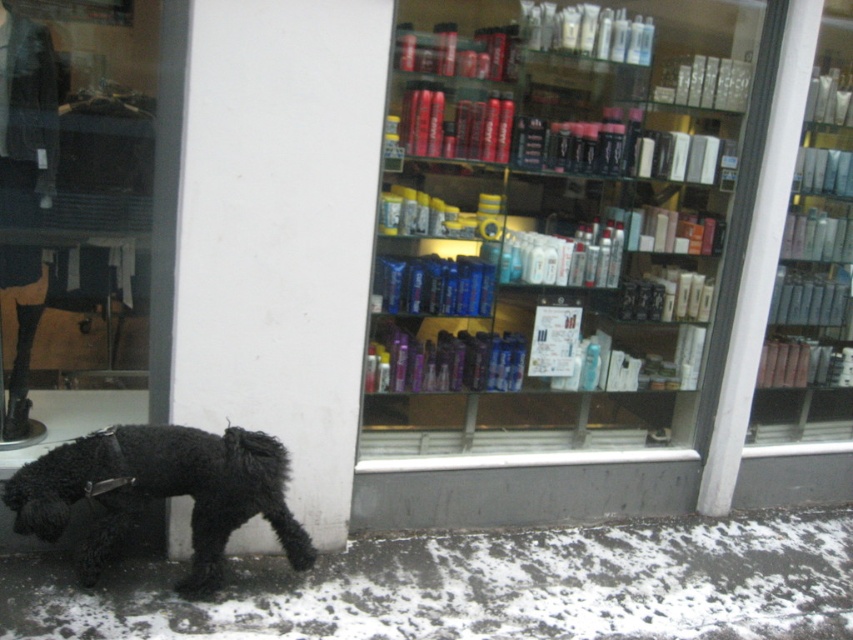
Question: Does translucent glass shelves at center have a greater width compared to black fuzzy dog at lower left?

Choices:
 (A) yes
 (B) no

Answer: (A)

Question: Which point appears closest to the camera in this image?

Choices:
 (A) (245, 444)
 (B) (583, 372)

Answer: (A)

Question: Among these points, which one is farthest from the camera?

Choices:
 (A) (88, 570)
 (B) (477, 112)

Answer: (B)

Question: Is translucent glass shelves at center to the left of black fuzzy dog at lower left from the viewer's perspective?

Choices:
 (A) no
 (B) yes

Answer: (A)

Question: Which object appears closest to the camera in this image?

Choices:
 (A) translucent glass shelves at center
 (B) black fuzzy dog at lower left

Answer: (B)

Question: Is translucent glass shelves at center bigger than black fuzzy dog at lower left?

Choices:
 (A) yes
 (B) no

Answer: (A)